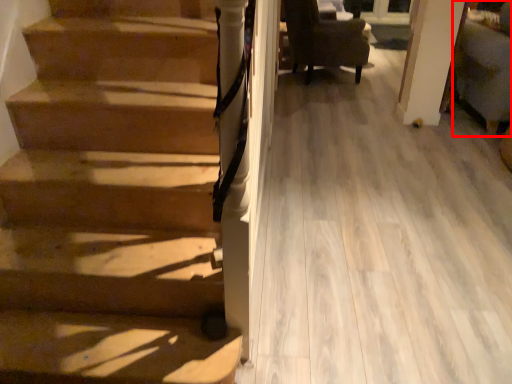
Question: From the image, what is the correct spatial relationship of armchair (annotated by the red box) in relation to chair?

Choices:
 (A) right
 (B) left

Answer: (A)